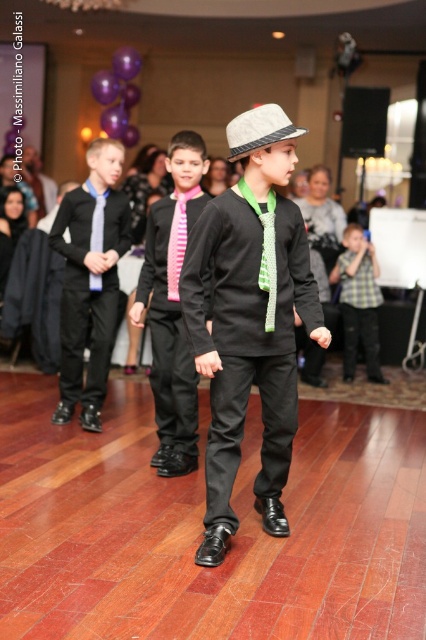
Is point (238, 362) in front of point (98, 248)?

Yes, it is in front of point (98, 248).

Can you confirm if matte black shirt at center is positioned above matte pink tie at center?

Actually, matte black shirt at center is below matte pink tie at center.

In order to click on matte black shirt at center in this screenshot , I will do `click(250, 320)`.

Which is above, matte black suit at center or black satin suit at center?

Positioned higher is black satin suit at center.

Can you confirm if matte black suit at center is shorter than black satin suit at center?

No.

Image resolution: width=426 pixels, height=640 pixels. What are the coordinates of `matte black suit at center` in the screenshot? It's located at (172, 307).

Is matte black suit at center wider than felt fedora at center?

Correct, the width of matte black suit at center exceeds that of felt fedora at center.

Does matte black suit at center appear over felt fedora at center?

No, matte black suit at center is not above felt fedora at center.

Is point (146, 257) positioned after point (250, 134)?

Yes, it is behind point (250, 134).

Where is `matte black suit at center`? matte black suit at center is located at coordinates (172, 307).